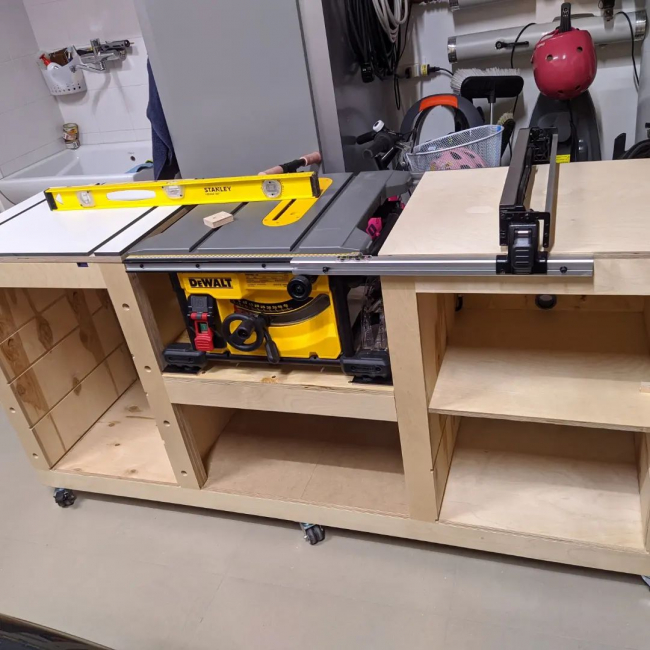
You are a GUI agent. You are given a task and a screenshot of the screen. Output one action in this format:
    pyautogui.click(x=<x>, y=<y>)
    Task: Click on the shelves
    This screenshot has height=650, width=650.
    Given the screenshot: What is the action you would take?
    pyautogui.click(x=521, y=415), pyautogui.click(x=318, y=400)